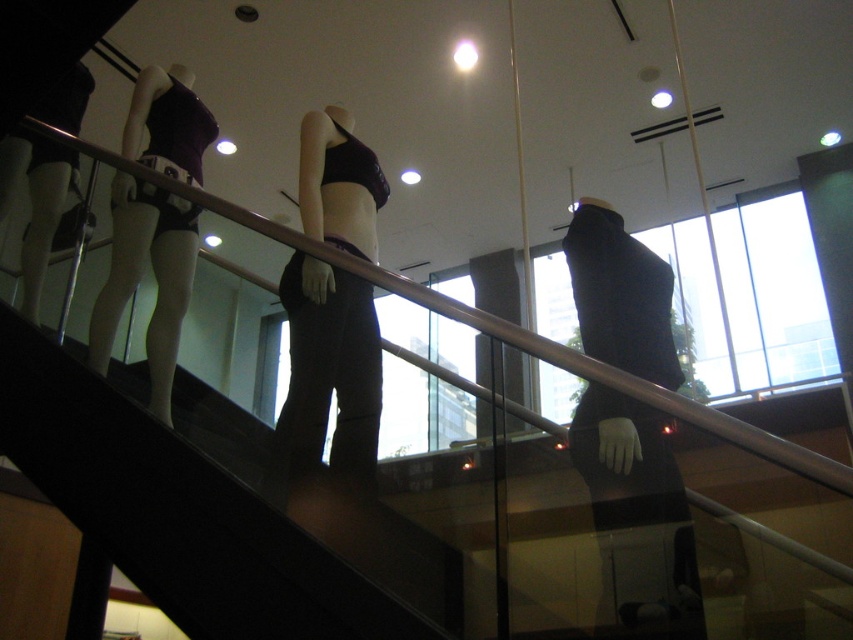
Describe the element at coordinates (175, 512) in the screenshot. I see `smooth black stairs at center` at that location.

Between smooth black stairs at center and matte black underwear at left, which one has less height?

With less height is smooth black stairs at center.

At what (x,y) coordinates should I click in order to perform the action: click on smooth black stairs at center. Please return your answer as a coordinate pair (x, y). Looking at the image, I should click on (175, 512).

Can you confirm if smooth black stairs at center is shorter than matte black leggings at center?

Yes, smooth black stairs at center is shorter than matte black leggings at center.

Who is more forward, (201,579) or (373,346)?

Point (201,579) is more forward.

Where is `smooth black stairs at center`? This screenshot has width=853, height=640. smooth black stairs at center is located at coordinates (175, 512).

Find the location of a particular element. black matte dress at center is located at coordinates (637, 509).

Does point (605, 420) come behind point (369, 256)?

No, it is not.

Image resolution: width=853 pixels, height=640 pixels. In order to click on black matte dress at center in this screenshot , I will do `click(637, 509)`.